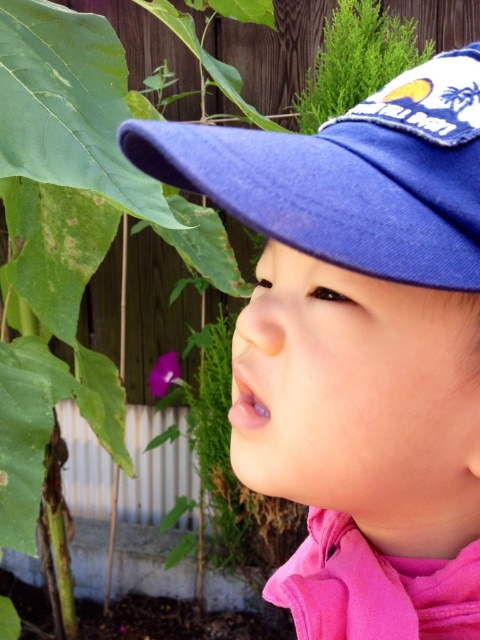
Looking at this image, which is more to the right, blue fabric cap at upper center or blue fabric baseball cap at upper center?

blue fabric cap at upper center is more to the right.

Does point (369, 490) come in front of point (384, 116)?

No, (369, 490) is further to viewer.

At what (x,y) coordinates should I click in order to perform the action: click on blue fabric cap at upper center. Please return your answer as a coordinate pair (x, y). The image size is (480, 640). Looking at the image, I should click on (359, 346).